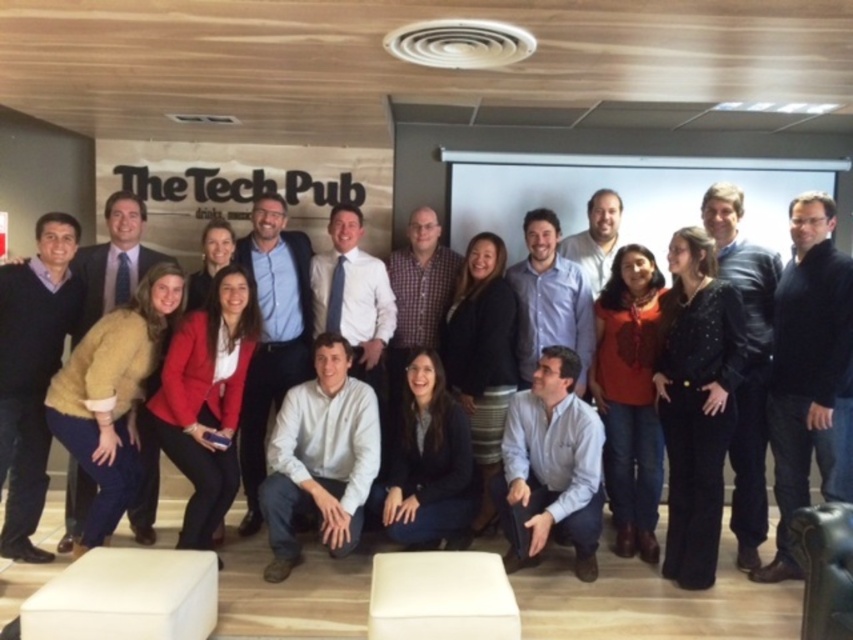
Does matte red sweater at center have a smaller size compared to black matte jacket at center?

No, matte red sweater at center is not smaller than black matte jacket at center.

Is point (653, 339) positioned behind point (409, 388)?

No, (653, 339) is closer to viewer.

You are a GUI agent. You are given a task and a screenshot of the screen. Output one action in this format:
    pyautogui.click(x=<x>, y=<y>)
    Task: Click on the matte red sweater at center
    
    Given the screenshot: What is the action you would take?
    pyautogui.click(x=630, y=397)

You are a GUI agent. You are given a task and a screenshot of the screen. Output one action in this format:
    pyautogui.click(x=<x>, y=<y>)
    Task: Click on the matte red sweater at center
    
    Given the screenshot: What is the action you would take?
    pyautogui.click(x=630, y=397)

Who is shorter, black sweater at center or matte black sweater at left?

matte black sweater at left is shorter.

Which is in front, point (802, 384) or point (27, 467)?

Point (802, 384) is in front.

Who is more distant from viewer, [802,358] or [67,256]?

Positioned behind is point [67,256].

This screenshot has height=640, width=853. I want to click on black sweater at center, so (809, 372).

Does matte black sweater at left have a lesser height compared to black matte jacket at center?

In fact, matte black sweater at left may be taller than black matte jacket at center.

Is matte black sweater at left closer to camera compared to black matte jacket at center?

Yes, matte black sweater at left is in front of black matte jacket at center.

Image resolution: width=853 pixels, height=640 pixels. Find the location of `matte black sweater at left`. matte black sweater at left is located at coordinates (32, 372).